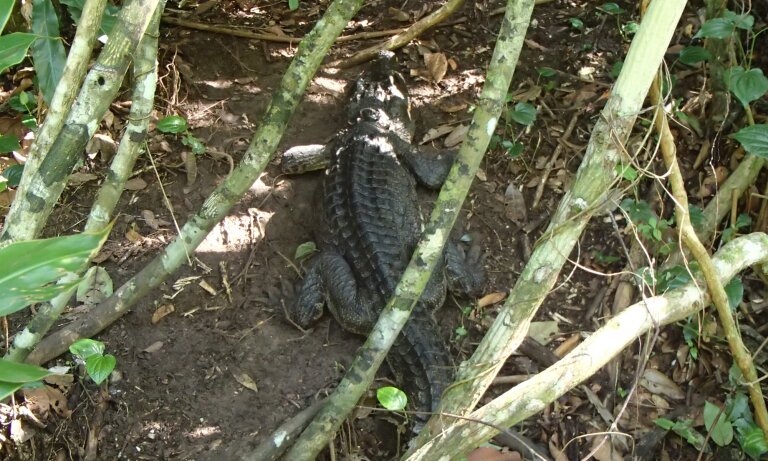
I want to click on scales, so point(366,186).